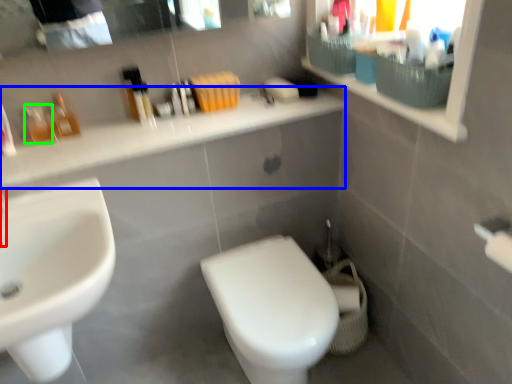
Question: Based on their relative distances, which object is nearer to faucet (highlighted by a red box)? Choose from counter top (highlighted by a blue box) and toiletry (highlighted by a green box).

Choices:
 (A) counter top
 (B) toiletry

Answer: (B)